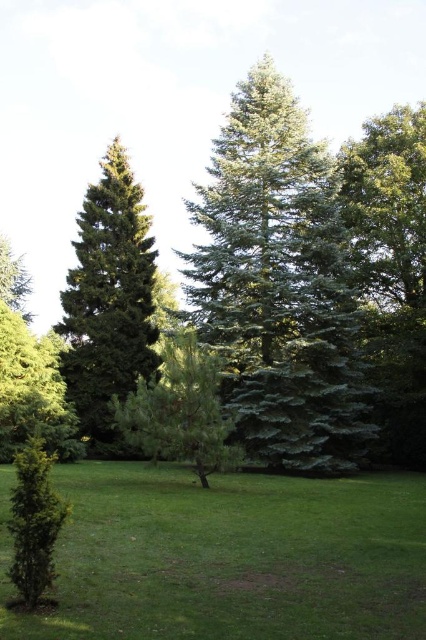
Question: Is green needle-like at center wider than green needle-like tree at left?

Choices:
 (A) yes
 (B) no

Answer: (A)

Question: Among these points, which one is farthest from the camera?

Choices:
 (A) (31, 406)
 (B) (279, 576)
 (C) (187, 253)
 (D) (176, 380)

Answer: (C)

Question: Based on their relative distances, which object is farther from the green grass at center?

Choices:
 (A) green matte tree at center
 (B) green matte evergreen tree at lower left

Answer: (B)

Question: Is green needle-like at center thinner than green matte tree at center?

Choices:
 (A) no
 (B) yes

Answer: (A)

Question: Can you confirm if green needle-like tree at left is positioned above green matte tree at center?

Choices:
 (A) yes
 (B) no

Answer: (A)

Question: Which point is closer to the camera?

Choices:
 (A) (85, 250)
 (B) (25, 381)

Answer: (B)